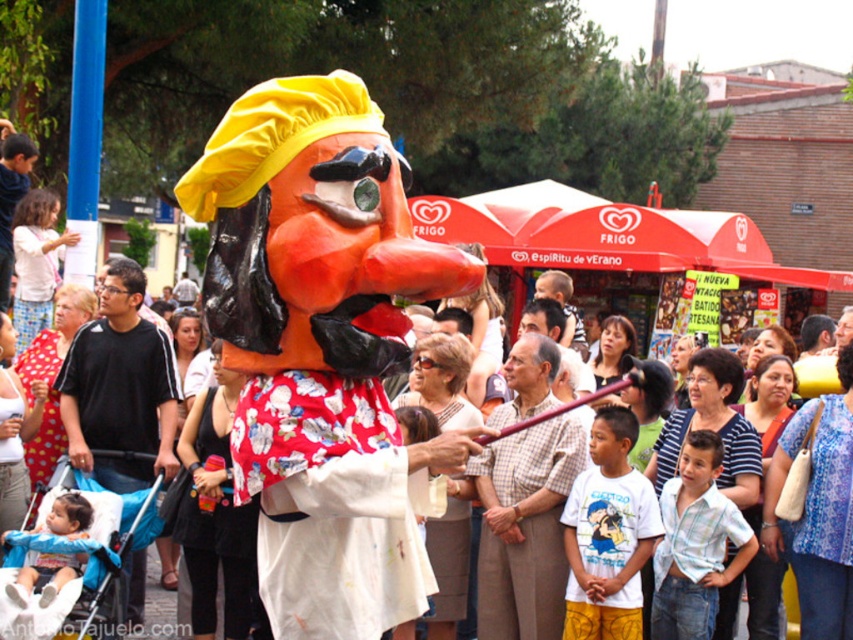
Question: Which of the following is the farthest from the observer?

Choices:
 (A) (x=294, y=417)
 (B) (x=561, y=428)
 (C) (x=125, y=262)

Answer: (C)

Question: Which object is positioned farthest from the printed fabric cape at center?

Choices:
 (A) checkered fabric shirt at center
 (B) black cotton shirt at center
 (C) matte black shirt at left

Answer: (C)

Question: Can you confirm if checkered fabric shirt at center is thinner than matte black shirt at left?

Choices:
 (A) no
 (B) yes

Answer: (A)

Question: Which point is farther to the camera?

Choices:
 (A) black cotton shirt at center
 (B) checkered fabric shirt at center

Answer: (A)

Question: Does printed fabric cape at center come behind matte black shirt at left?

Choices:
 (A) no
 (B) yes

Answer: (A)

Question: Is printed fabric cape at center to the right of black cotton shirt at center from the viewer's perspective?

Choices:
 (A) yes
 (B) no

Answer: (A)